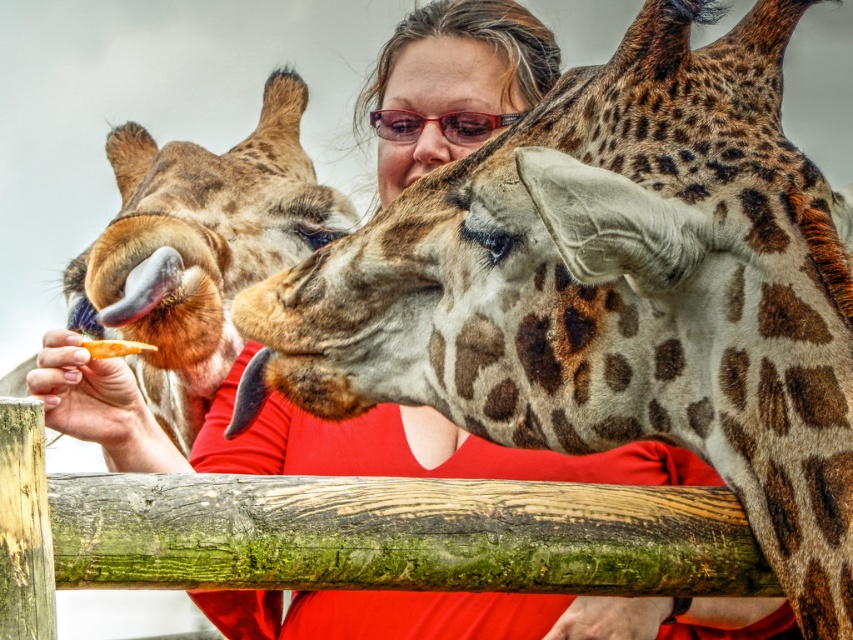
Between spotted fur giraffe at upper center and translucent plastic goggles at center, which one is positioned higher?

translucent plastic goggles at center is higher up.

Which of these two, spotted fur giraffe at upper center or translucent plastic goggles at center, stands shorter?

translucent plastic goggles at center is shorter.

Is point (641, 182) closer to viewer compared to point (498, 122)?

Yes, it is in front of point (498, 122).

Where is `spotted fur giraffe at upper center`? Image resolution: width=853 pixels, height=640 pixels. spotted fur giraffe at upper center is located at coordinates (613, 291).

Who is positioned more to the right, spotted fur giraffe at upper center or spotted fur giraffe at left?

From the viewer's perspective, spotted fur giraffe at upper center appears more on the right side.

Looking at this image, which of these two, spotted fur giraffe at upper center or spotted fur giraffe at left, stands taller?

spotted fur giraffe at left is taller.

This screenshot has width=853, height=640. Find the location of `spotted fur giraffe at upper center`. spotted fur giraffe at upper center is located at coordinates (613, 291).

The width and height of the screenshot is (853, 640). In order to click on spotted fur giraffe at upper center in this screenshot , I will do `click(613, 291)`.

Is spotted fur giraffe at left smaller than translucent plastic goggles at center?

Incorrect, spotted fur giraffe at left is not smaller in size than translucent plastic goggles at center.

Is point (152, 234) closer to camera compared to point (399, 134)?

Yes, it is in front of point (399, 134).

Locate an element on the screen. The width and height of the screenshot is (853, 640). spotted fur giraffe at left is located at coordinates (199, 248).